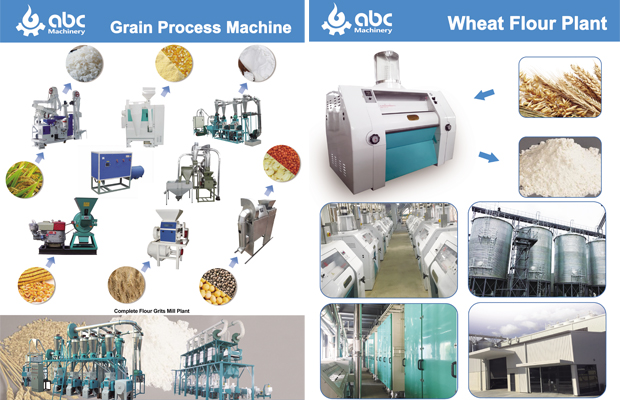
Locate an element on the screen. The image size is (620, 400). plant is located at coordinates 16,171.